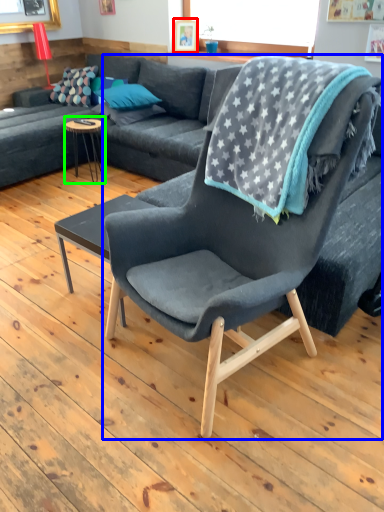
Question: Which object is the closest to the picture frame (highlighted by a red box)? Choose among these: chair (highlighted by a blue box) or coffee table (highlighted by a green box).

Choices:
 (A) chair
 (B) coffee table

Answer: (B)